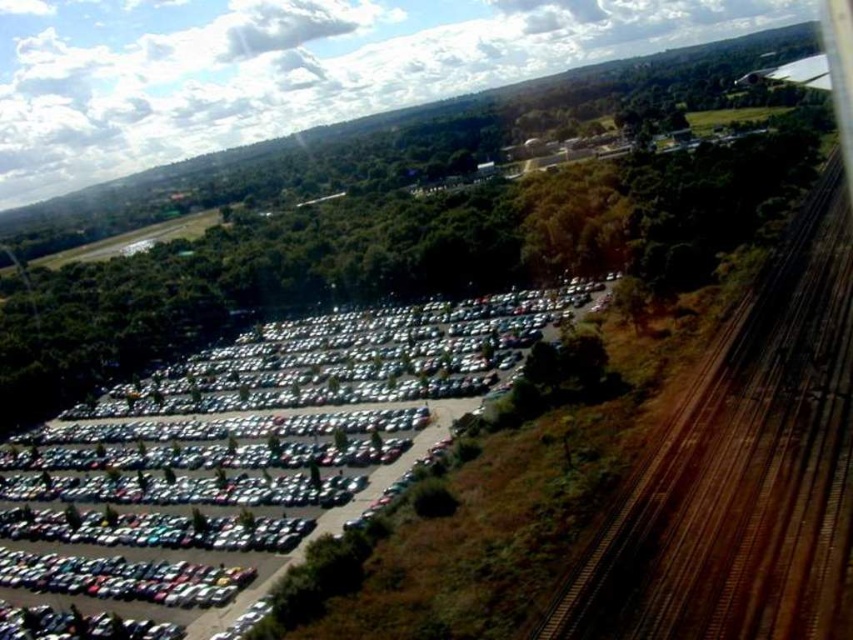
Question: Which point is closer to the camera?

Choices:
 (A) (155, 481)
 (B) (846, 352)

Answer: (B)

Question: Which point is farther from the camera taking this photo?

Choices:
 (A) (659, 572)
 (B) (117, 552)

Answer: (B)

Question: Among these points, which one is farthest from the camera?

Choices:
 (A) (792, 456)
 (B) (326, 464)

Answer: (B)

Question: Is shiny metallic cars at center bigger than brown wooden train tracks at right?

Choices:
 (A) yes
 (B) no

Answer: (A)

Question: Is shiny metallic cars at center further to camera compared to brown wooden train tracks at right?

Choices:
 (A) no
 (B) yes

Answer: (B)

Question: Does shiny metallic cars at center appear on the left side of brown wooden train tracks at right?

Choices:
 (A) yes
 (B) no

Answer: (A)